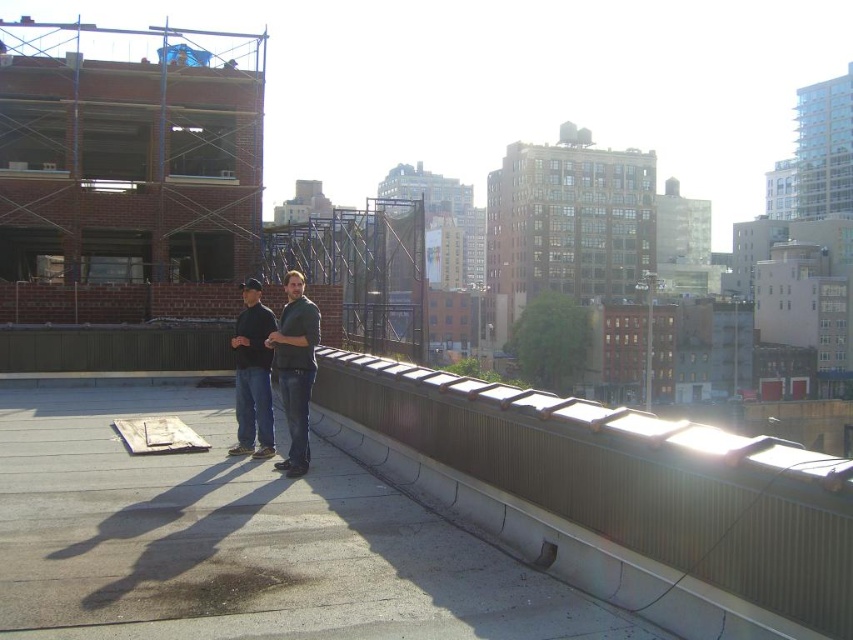
You are standing on the rooftop and want to place a 1.5 meter tall ladder between the metallic gray rail at upper right and the dark gray sweater at center. Will the ladder fit vertically between them?

The metallic gray rail at upper right is shorter than the dark gray sweater at center. Since the ladder is 1.5 meters tall, it might not fit vertically between them if the rail is too short. However, without specific measurements of their heights, it is impossible to determine for certain.

You are a delivery person who needs to place a large package on the gray concrete pavement at center without it overlapping the dark gray sweater at center. Is there enough space?

The gray concrete pavement at center is bigger than the dark gray sweater at center, so there is enough space to place the large package on the gray concrete pavement at center without overlapping the dark gray sweater at center.

You are a fashion designer observing two people on a rooftop. You notice both are wearing dark gray tops. One is wearing a dark gray blazer at center and the other a dark gray sweater at center. Which of these two tops is taller when viewed from the front?

The dark gray blazer at center is taller than the dark gray sweater at center.